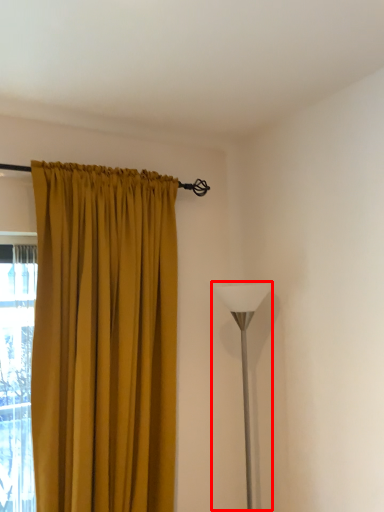
Question: From the image's perspective, what is the correct spatial positioning of table lamp (annotated by the red box) in reference to curtain?

Choices:
 (A) above
 (B) below

Answer: (B)